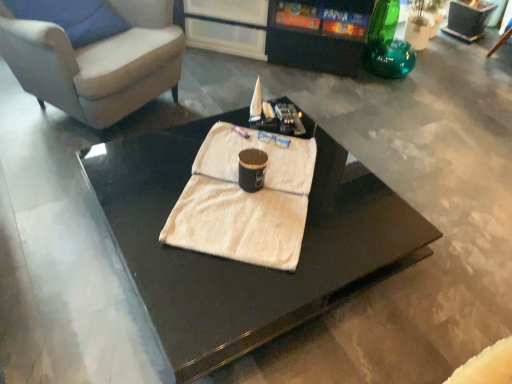
Question: Is black glossy coffee table at center positioned in front of white textured towel at center?

Choices:
 (A) yes
 (B) no

Answer: (A)

Question: Does black glossy coffee table at center have a larger size compared to white textured towel at center?

Choices:
 (A) no
 (B) yes

Answer: (B)

Question: From the image's perspective, is black glossy coffee table at center located above white textured towel at center?

Choices:
 (A) yes
 (B) no

Answer: (B)

Question: Can you confirm if black glossy coffee table at center is taller than white textured towel at center?

Choices:
 (A) yes
 (B) no

Answer: (A)

Question: Does black glossy coffee table at center have a lesser height compared to white textured towel at center?

Choices:
 (A) yes
 (B) no

Answer: (B)

Question: From a real-world perspective, is black glossy coffee table at center located higher than white textured towel at center?

Choices:
 (A) yes
 (B) no

Answer: (B)

Question: Does black glossy entertainment center at upper center appear on the right side of white textured towel at center?

Choices:
 (A) yes
 (B) no

Answer: (A)

Question: Is black glossy entertainment center at upper center further to camera compared to white textured towel at center?

Choices:
 (A) yes
 (B) no

Answer: (A)

Question: Is black glossy entertainment center at upper center positioned with its back to white textured towel at center?

Choices:
 (A) yes
 (B) no

Answer: (B)

Question: Does black glossy entertainment center at upper center have a greater width compared to white textured towel at center?

Choices:
 (A) yes
 (B) no

Answer: (A)

Question: Is black glossy entertainment center at upper center next to white textured towel at center?

Choices:
 (A) no
 (B) yes

Answer: (A)

Question: From the image's perspective, would you say black glossy entertainment center at upper center is positioned over white textured towel at center?

Choices:
 (A) yes
 (B) no

Answer: (A)

Question: Is white textured towel at center smaller than suede-like beige armchair at upper left?

Choices:
 (A) yes
 (B) no

Answer: (A)